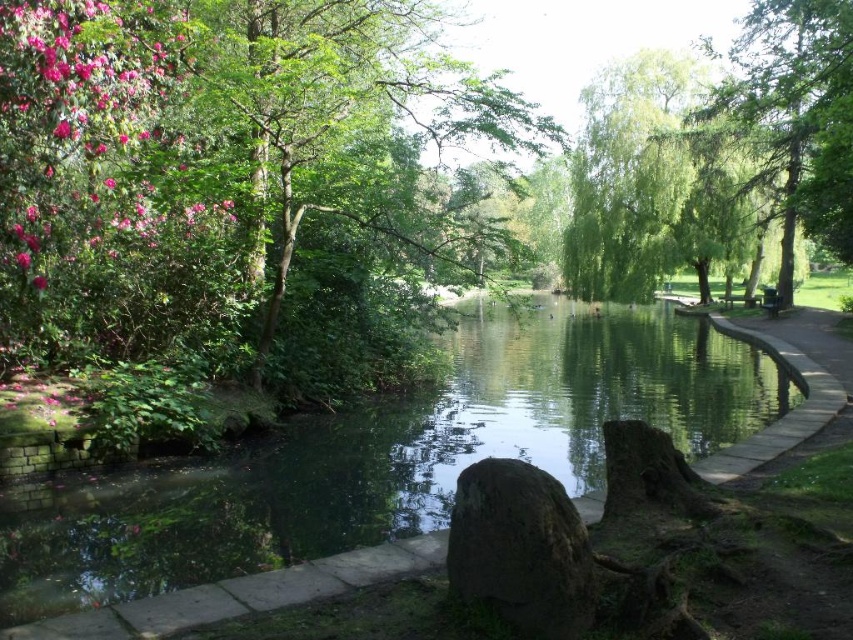
Question: Does green leafy tree at upper left have a greater width compared to green mossy rock at center?

Choices:
 (A) yes
 (B) no

Answer: (A)

Question: Which object is the closest to the green smooth water at center?

Choices:
 (A) green mossy rock at center
 (B) smooth concrete path at right
 (C) green leafy tree at upper left

Answer: (B)

Question: Which object is the farthest from the smooth concrete path at right?

Choices:
 (A) green leafy tree at right
 (B) green mossy rock at center
 (C) green smooth water at center
 (D) green leafy tree at upper left

Answer: (D)

Question: Which point appears closest to the camera in this image?

Choices:
 (A) (795, 424)
 (B) (822, 148)

Answer: (A)

Question: Can you confirm if green smooth water at center is positioned to the left of green leafy tree at right?

Choices:
 (A) no
 (B) yes

Answer: (B)

Question: Observing the image, what is the correct spatial positioning of green smooth water at center in reference to green leafy tree at right?

Choices:
 (A) right
 (B) left

Answer: (B)